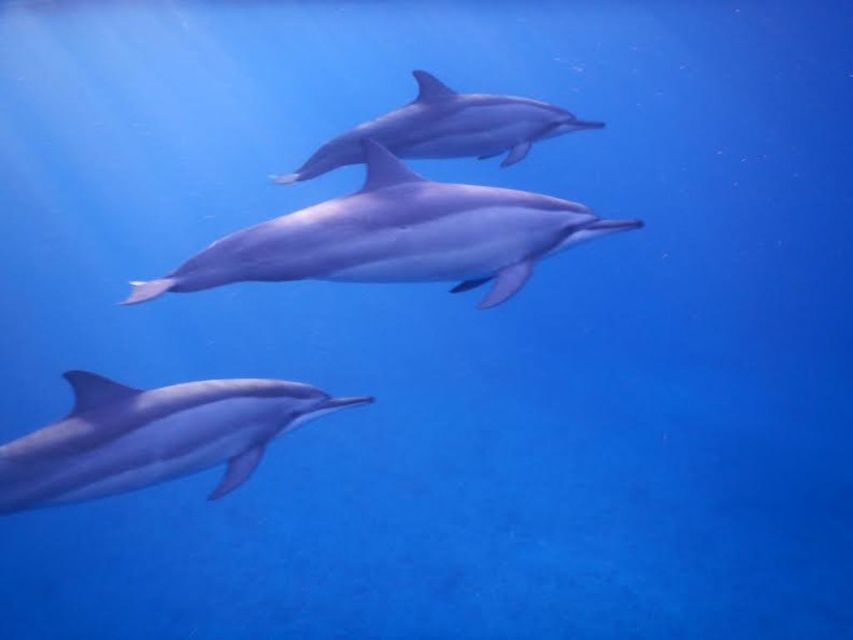
Is point (398, 236) less distant than point (340, 148)?

Yes, it is in front of point (340, 148).

Which is above, smooth gray dolphin at center or smooth skin dolphin at center?

smooth skin dolphin at center

Does point (538, 234) come in front of point (537, 106)?

Yes, point (538, 234) is in front of point (537, 106).

The width and height of the screenshot is (853, 640). I want to click on smooth gray dolphin at center, so click(395, 237).

Does sleek blue dolphin at lower left come behind smooth skin dolphin at center?

That is False.

Who is positioned more to the right, sleek blue dolphin at lower left or smooth skin dolphin at center?

smooth skin dolphin at center

Does point (190, 404) come farther from viewer compared to point (399, 115)?

No, it is in front of (399, 115).

Where is `sleek blue dolphin at lower left`? This screenshot has width=853, height=640. sleek blue dolphin at lower left is located at coordinates (152, 436).

Does point (401, 192) lie behind point (47, 504)?

Yes.

Can you confirm if smooth gray dolphin at center is positioned above sleek blue dolphin at lower left?

Yes, smooth gray dolphin at center is above sleek blue dolphin at lower left.

Between point (531, 259) and point (177, 474), which one is positioned behind?

The point (531, 259) is behind.

What are the coordinates of `smooth gray dolphin at center` in the screenshot? It's located at (395, 237).